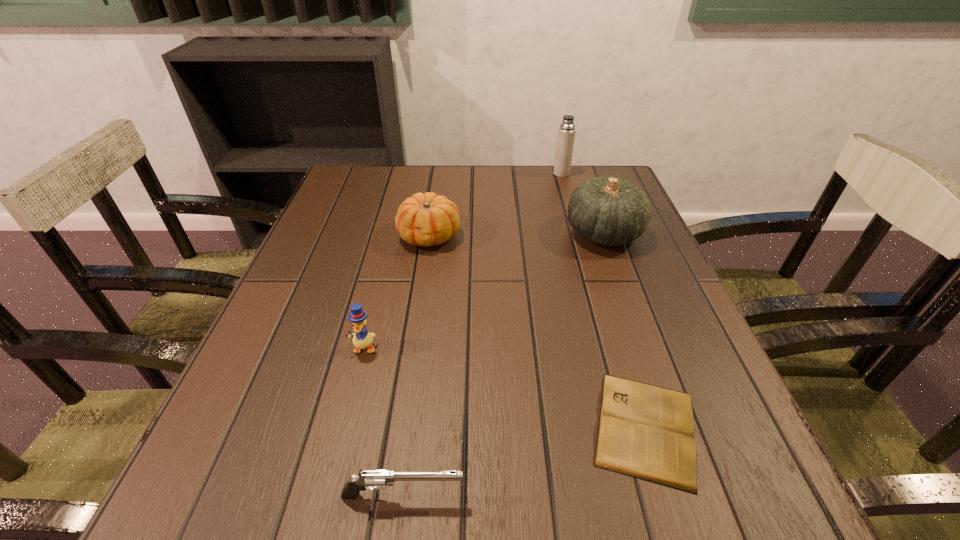
Identify the location of empty location between the shortest object and the second shortest object. Image resolution: width=960 pixels, height=540 pixels. (524, 462).

Identify the location of free space between the shortest object and the duckling. Image resolution: width=960 pixels, height=540 pixels. (505, 388).

Image resolution: width=960 pixels, height=540 pixels. In order to click on unoccupied area between the fourth farthest object and the thermos bottle in this screenshot , I will do `click(463, 260)`.

Identify the location of empty space that is in between the shortest object and the pistol. The image size is (960, 540). (524, 462).

Locate an element on the screen. Image resolution: width=960 pixels, height=540 pixels. object that is the fifth closest to the thermos bottle is located at coordinates (371, 479).

The height and width of the screenshot is (540, 960). In order to click on object that is the second closest one to the book in this screenshot , I will do `click(609, 211)`.

Find the location of a particular element. The width and height of the screenshot is (960, 540). vacant space that satisfies the following two spatial constraints: 1. on the face of the book, where the monocle is placed; 2. on the right side of the duckling is located at coordinates (344, 428).

At what (x,y) coordinates should I click in order to perform the action: click on free space that satisfies the following two spatial constraints: 1. on the front side of the right gourd; 2. on the left side of the thermos bottle. Please return your answer as a coordinate pair (x, y). The image size is (960, 540). Looking at the image, I should click on (579, 233).